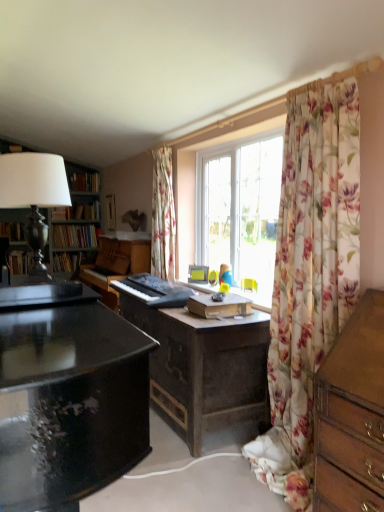
At what (x,y) coordinates should I click in order to perform the action: click on wooden picture frame at center, which is the second picture frame from front to back. Please return your answer as a coordinate pair (x, y). Looking at the image, I should click on (110, 212).

What do you see at coordinates (200, 361) in the screenshot? I see `wooden desk at center` at bounding box center [200, 361].

What do you see at coordinates (84, 182) in the screenshot? I see `hardcover book at left, the 4th book ordered from the bottom` at bounding box center [84, 182].

Measure the distance between hardcover book at left, which appears as the 1th book when ordered from the bottom, and camera.

hardcover book at left, which appears as the 1th book when ordered from the bottom, is 3.26 meters from camera.

Measure the distance between point (x=66, y=261) and camera.

They are 3.52 meters apart.

Find the location of a particular element. wooden picture frame at center, marked as the second picture frame in a right-to-left arrangement is located at coordinates (110, 212).

Which of these two, floral fabric curtain at center, arranged as the 2th curtain when viewed from the front, or dark wood bookcase at left, is wider?

With larger width is dark wood bookcase at left.

From a real-world perspective, which object rests below the other?

From a 3D spatial view, floral fabric curtain at center, which appears as the 2th curtain when viewed from the right, is below.

Considering the positions of point (172, 264) and point (3, 175), is point (172, 264) closer or farther from the camera than point (3, 175)?

Point (172, 264) is farther from the camera than point (3, 175).

Is floral fabric curtain at center, which is the 1th curtain in back-to-front order, positioned far away from dark wood bookcase at left?

That's right, there is a large distance between floral fabric curtain at center, which is the 1th curtain in back-to-front order, and dark wood bookcase at left.

Are floral sheer curtain at right, which appears as the second curtain when viewed from the left, and hardcover book at left, which is the fourth book in top-to-bottom order, far apart?

Yes.

Would you say floral sheer curtain at right, which appears as the second curtain when viewed from the left, is inside or outside hardcover book at left, which is the fourth book in top-to-bottom order?

floral sheer curtain at right, which appears as the second curtain when viewed from the left, is outside hardcover book at left, which is the fourth book in top-to-bottom order.

From a real-world perspective, is floral sheer curtain at right, placed as the 1th curtain when sorted from right to left, on top of hardcover book at left, which appears as the 1th book when ordered from the bottom?

Yes, from a real-world perspective, floral sheer curtain at right, placed as the 1th curtain when sorted from right to left, is over hardcover book at left, which appears as the 1th book when ordered from the bottom

How much distance is there between floral sheer curtain at right, placed as the 1th curtain when sorted from right to left, and hardcover book at left, which is the fourth book in top-to-bottom order?

floral sheer curtain at right, placed as the 1th curtain when sorted from right to left, is 2.00 meters away from hardcover book at left, which is the fourth book in top-to-bottom order.

Is point (163, 298) positioned in front of point (86, 185)?

Yes.

How many degrees apart are the facing directions of wooden desk at center and hardcover book at left, the 4th book ordered from the bottom?

The angle between the facing direction of wooden desk at center and the facing direction of hardcover book at left, the 4th book ordered from the bottom, is 91.8 degrees.

Considering the relative sizes of wooden desk at center and hardcover book at left, the 4th book ordered from the bottom, in the image provided, is wooden desk at center bigger than hardcover book at left, the 4th book ordered from the bottom,?

Correct, wooden desk at center is larger in size than hardcover book at left, the 4th book ordered from the bottom.

Considering the relative sizes of hardcover book at left, acting as the second book starting from the top, and floral fabric curtain at center, which appears as the 2th curtain when viewed from the right, in the image provided, is hardcover book at left, acting as the second book starting from the top, shorter than floral fabric curtain at center, which appears as the 2th curtain when viewed from the right,?

Correct, hardcover book at left, acting as the second book starting from the top, is not as tall as floral fabric curtain at center, which appears as the 2th curtain when viewed from the right.

Is hardcover book at left, arranged as the 3th book when ordered from the bottom, wider than floral fabric curtain at center, arranged as the 1th curtain when viewed from the left?

Indeed, hardcover book at left, arranged as the 3th book when ordered from the bottom, has a greater width compared to floral fabric curtain at center, arranged as the 1th curtain when viewed from the left.

From the image's perspective, which one is positioned lower, hardcover book at left, acting as the second book starting from the top, or floral fabric curtain at center, arranged as the 1th curtain when viewed from the left?

floral fabric curtain at center, arranged as the 1th curtain when viewed from the left, from the image's perspective.

Considering the positions of objects hardcover book at left, arranged as the 3th book when ordered from the bottom, and floral fabric curtain at center, which appears as the 2th curtain when viewed from the right, in the image provided, who is behind, hardcover book at left, arranged as the 3th book when ordered from the bottom, or floral fabric curtain at center, which appears as the 2th curtain when viewed from the right,?

hardcover book at left, arranged as the 3th book when ordered from the bottom, is behind.

Considering the points (106, 195) and (179, 420), which point is behind, point (106, 195) or point (179, 420)?

The point (106, 195) is behind.

What's the angular difference between wooden picture frame at center, which is the second picture frame from front to back, and wooden desk at center's facing directions?

There is a 0.921-degree angle between the facing directions of wooden picture frame at center, which is the second picture frame from front to back, and wooden desk at center.

From a real-world perspective, is wooden picture frame at center, the first picture frame in the left-to-right sequence, over wooden desk at center?

Yes, from a real-world perspective, wooden picture frame at center, the first picture frame in the left-to-right sequence, is over wooden desk at center

Considering the relative positions of wooden picture frame at center, marked as the second picture frame in a right-to-left arrangement, and wooden desk at center in the image provided, is wooden picture frame at center, marked as the second picture frame in a right-to-left arrangement, to the right of wooden desk at center from the viewer's perspective?

No, wooden picture frame at center, marked as the second picture frame in a right-to-left arrangement, is not to the right of wooden desk at center.

Which object is further away from the camera, black matte keyboard at center or wooden picture frame at center, marked as the second picture frame in a right-to-left arrangement?

wooden picture frame at center, marked as the second picture frame in a right-to-left arrangement, is behind.

From the image's perspective, is black matte keyboard at center over wooden picture frame at center, placed as the first picture frame when sorted from top to bottom?

No, from the image's perspective, black matte keyboard at center is not above wooden picture frame at center, placed as the first picture frame when sorted from top to bottom.

Which of these two, black matte keyboard at center or wooden picture frame at center, which is the second picture frame from front to back, is wider?

With larger width is black matte keyboard at center.

From a real-world perspective, who is located lower, black matte keyboard at center or wooden picture frame at center, which is the second picture frame from front to back?

black matte keyboard at center is physically lower.

Based on the photo, is matte yellow picture frame at center, the second picture frame when ordered from back to front, oriented towards black matte keyboard at center?

Yes.

What's the angular difference between matte yellow picture frame at center, which is counted as the second picture frame, starting from the left, and black matte keyboard at center's facing directions?

31 degrees.

Based on the photo, from the image's perspective, would you say matte yellow picture frame at center, which is the 1th picture frame in front-to-back order, is positioned over black matte keyboard at center?

Indeed, from the image's perspective, matte yellow picture frame at center, which is the 1th picture frame in front-to-back order, is shown above black matte keyboard at center.

Identify the location of the 1st curtain below the dark wood bookcase at left (from the image's perspective). (163, 216).

The image size is (384, 512). I want to click on the 1st book positioned above the floral sheer curtain at right, the 1th curtain viewed from the front (from the image's perspective), so click(72, 260).

Which object lies further to the anchor point wooden desk at center, hardcover book at left, the 4th book ordered from the bottom, or hardcover book at left, which is the fourth book in top-to-bottom order?

hardcover book at left, the 4th book ordered from the bottom.

Estimate the real-world distances between objects in this image. Which object is closer to hardcover book at left, which appears as the 1th book when ordered from the bottom, dark wood bookcase at left or hardcover book at left, the 4th book ordered from the bottom?

dark wood bookcase at left lies closer to hardcover book at left, which appears as the 1th book when ordered from the bottom, than the other object.

Considering their positions, is dark wood bookcase at left positioned closer to black matte keyboard at center than floral sheer curtain at right, positioned as the 2th curtain in back-to-front order?

dark wood bookcase at left is positioned closer to the anchor black matte keyboard at center.

Which object lies further to the anchor point floral sheer curtain at right, which appears as the second curtain when viewed from the left, wooden picture frame at center, placed as the first picture frame when sorted from top to bottom, or hardcover book at left, which is the 2th book from bottom to top?

The object further to floral sheer curtain at right, which appears as the second curtain when viewed from the left, is wooden picture frame at center, placed as the first picture frame when sorted from top to bottom.

Estimate the real-world distances between objects in this image. Which object is further from wooden picture frame at center, which is the second picture frame from front to back, hardcover book at left, the 4th book ordered from the bottom, or hardcover book at left, which is the 2th book from bottom to top?

hardcover book at left, which is the 2th book from bottom to top, lies further to wooden picture frame at center, which is the second picture frame from front to back, than the other object.

Estimate the real-world distances between objects in this image. Which object is closer to dark wood bookcase at left, wooden picture frame at center, which is the second picture frame from front to back, or matte yellow picture frame at center, which is counted as the second picture frame, starting from the left?

The object closer to dark wood bookcase at left is matte yellow picture frame at center, which is counted as the second picture frame, starting from the left.

From the image, which object appears to be nearer to hardcover book at left, the third book positioned from the top, hardcover book at left, which appears as the 1th book when ordered from the bottom, or hardcover book at left, the 4th book ordered from the bottom?

hardcover book at left, which appears as the 1th book when ordered from the bottom, is positioned closer to the anchor hardcover book at left, the third book positioned from the top.

In the scene shown: Considering their positions, is floral fabric curtain at center, which appears as the 2th curtain when viewed from the right, positioned further to hardcover book at left, arranged as the 3th book when ordered from the bottom, than wooden picture frame at center, placed as the first picture frame when sorted from top to bottom?

floral fabric curtain at center, which appears as the 2th curtain when viewed from the right, is positioned further to the anchor hardcover book at left, arranged as the 3th book when ordered from the bottom.

Image resolution: width=384 pixels, height=512 pixels. Find the location of `piano located between floral sheer curtain at right, positioned as the 2th curtain in back-to-front order, and matte yellow picture frame at center, placed as the 1th picture frame when sorted from bottom to top, in the depth direction`. piano located between floral sheer curtain at right, positioned as the 2th curtain in back-to-front order, and matte yellow picture frame at center, placed as the 1th picture frame when sorted from bottom to top, in the depth direction is located at coordinates (154, 291).

I want to click on picture frame between matte yellow picture frame at center, placed as the second picture frame when sorted from top to bottom, and hardcover book at left, which appears as the 1th book when ordered from the bottom, from front to back, so click(110, 212).

You are a GUI agent. You are given a task and a screenshot of the screen. Output one action in this format:
    pyautogui.click(x=<x>, y=<y>)
    Task: Click on the picture frame between hardcover book at left, the 4th book ordered from the bottom, and hardcover book at left, which is the fourth book in top-to-bottom order, vertically
    Image resolution: width=384 pixels, height=512 pixels.
    Given the screenshot: What is the action you would take?
    pyautogui.click(x=110, y=212)

The width and height of the screenshot is (384, 512). In order to click on curtain located between black matte keyboard at center and hardcover book at left, arranged as the 3th book when ordered from the bottom, in the depth direction in this screenshot , I will do `click(163, 216)`.